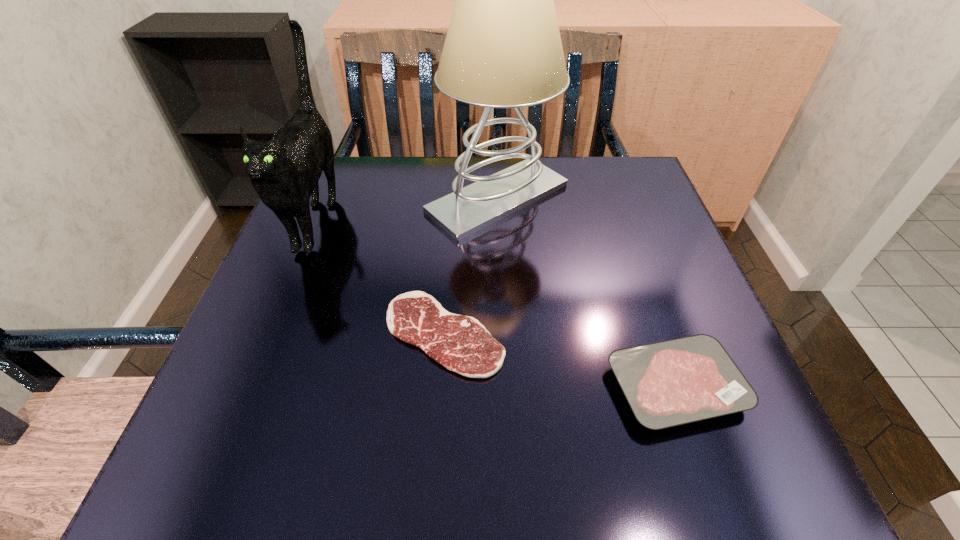
The height and width of the screenshot is (540, 960). I want to click on vacant area that satisfies the following two spatial constraints: 1. on the face of the cat; 2. on the left side of the right steak, so click(x=250, y=387).

This screenshot has height=540, width=960. I want to click on vacant space that satisfies the following two spatial constraints: 1. on the face of the left steak; 2. on the left side of the leftmost object, so click(x=271, y=334).